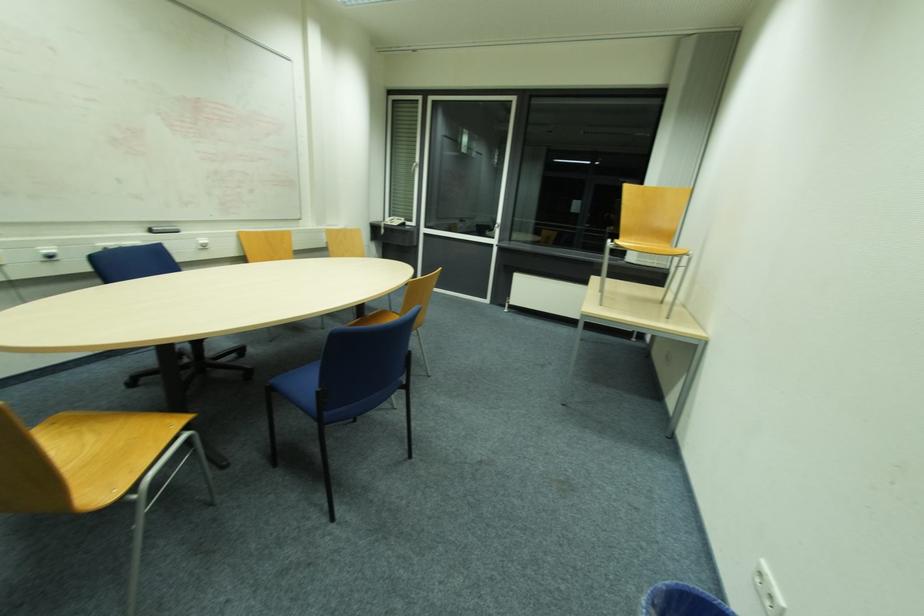
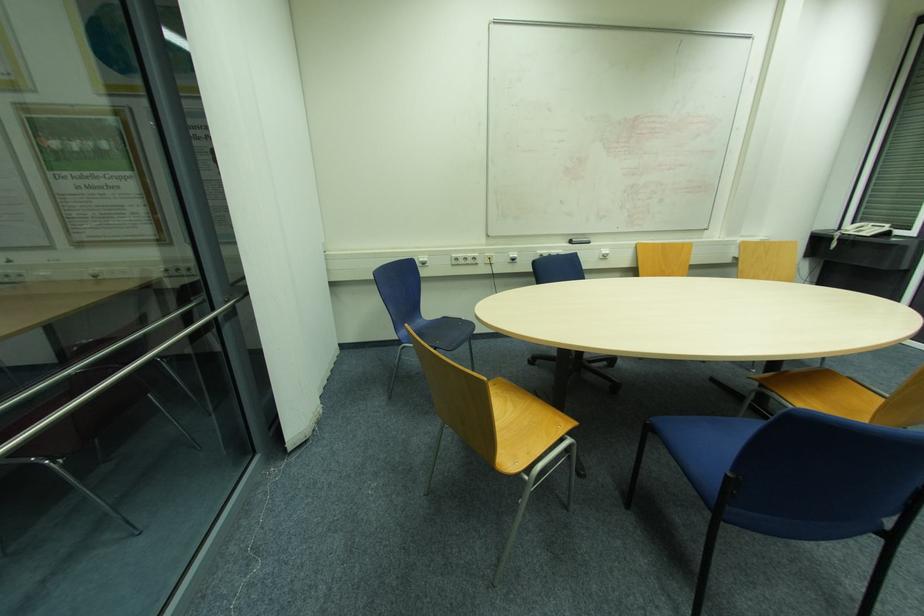
Where in the second image is the point corresponding to the point at 397,225 from the first image?

(869, 233)